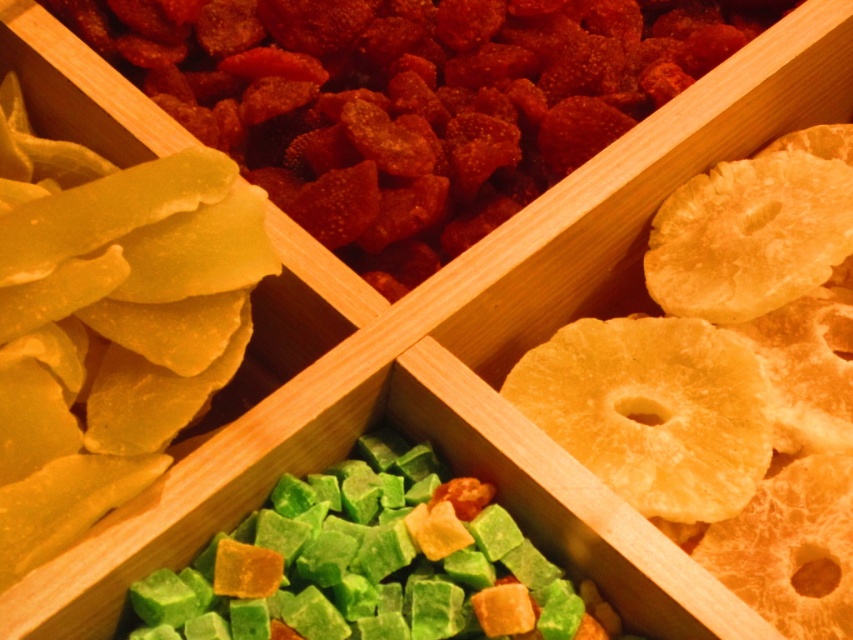
You are standing 1 meter away from a wooden compartmentalized tray with four sections. You notice a point at coordinates point (320, 182). Can you reach this point without moving closer to the tray?

The point (320, 182) is 1.15 meters away from the viewer. Since you are already 1 meter away, you need to move 0.15 meters closer to reach it.

You are a child who wants to reach both the yellow translucent gummy at upper left and the golden textured pineapple slices at right from where you are standing. The maximum distance you can comfortably reach is 12 inches. Can you comfortably reach both items without moving your position?

The yellow translucent gummy at upper left is 15.08 inches away from the golden textured pineapple slices at right. Since the distance between them is greater than your 12 inches comfortable reach, you cannot comfortably reach both items without moving your position.